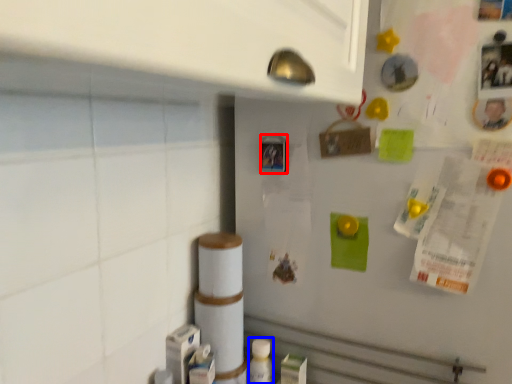
Question: Which object appears farthest to the camera in this image, button (highlighted by a red box) or bottle (highlighted by a blue box)?

Choices:
 (A) button
 (B) bottle

Answer: (B)